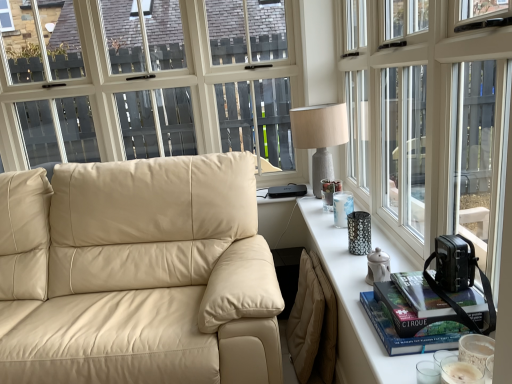
Question: Can you confirm if textured gray lamp at upper right is thinner than hardcover book at right, marked as the first book in a bottom-to-top arrangement?

Choices:
 (A) no
 (B) yes

Answer: (A)

Question: Would you say textured gray lamp at upper right contains hardcover book at right, marked as the first book in a bottom-to-top arrangement?

Choices:
 (A) yes
 (B) no

Answer: (B)

Question: Is textured gray lamp at upper right directly adjacent to hardcover book at right, marked as the first book in a bottom-to-top arrangement?

Choices:
 (A) no
 (B) yes

Answer: (A)

Question: Is textured gray lamp at upper right closer to the viewer compared to hardcover book at right, the second book viewed from the top?

Choices:
 (A) yes
 (B) no

Answer: (B)

Question: Is there a large distance between textured gray lamp at upper right and hardcover book at right, marked as the first book in a bottom-to-top arrangement?

Choices:
 (A) yes
 (B) no

Answer: (A)

Question: Is beige leather couch at left situated inside textured gray lamp at upper right or outside?

Choices:
 (A) inside
 (B) outside

Answer: (B)

Question: In the image, is beige leather couch at left positioned in front of or behind textured gray lamp at upper right?

Choices:
 (A) behind
 (B) front

Answer: (B)

Question: Based on their sizes in the image, would you say beige leather couch at left is bigger or smaller than textured gray lamp at upper right?

Choices:
 (A) small
 (B) big

Answer: (B)

Question: From a real-world perspective, is beige leather couch at left positioned above or below textured gray lamp at upper right?

Choices:
 (A) below
 (B) above

Answer: (A)

Question: In terms of height, does hardcover book at right, which appears as the first book when viewed from the top, look taller or shorter compared to transparent glass window at upper right?

Choices:
 (A) short
 (B) tall

Answer: (A)

Question: From the image's perspective, is hardcover book at right, which appears as the first book when viewed from the top, above or below transparent glass window at upper right?

Choices:
 (A) above
 (B) below

Answer: (B)

Question: Based on their positions, is hardcover book at right, arranged as the second book when ordered from the bottom, located to the left or right of transparent glass window at upper right?

Choices:
 (A) right
 (B) left

Answer: (B)

Question: Is hardcover book at right, which appears as the first book when viewed from the top, inside the boundaries of transparent glass window at upper right, or outside?

Choices:
 (A) inside
 (B) outside

Answer: (B)

Question: From a real-world perspective, is beige leather couch at left above or below hardcover book at right, which appears as the first book when viewed from the top?

Choices:
 (A) below
 (B) above

Answer: (A)

Question: From the image's perspective, relative to hardcover book at right, arranged as the second book when ordered from the bottom, is beige leather couch at left above or below?

Choices:
 (A) above
 (B) below

Answer: (B)